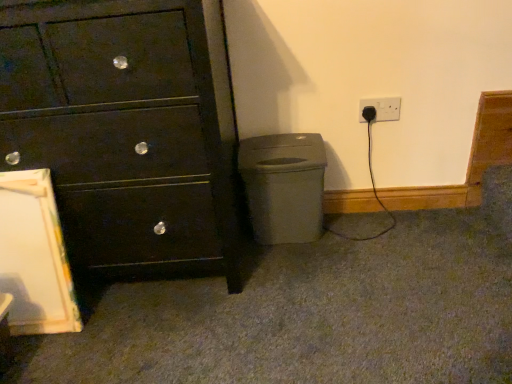
This screenshot has height=384, width=512. In order to click on black plastic plug at lower right in this screenshot , I will do `click(382, 108)`.

This screenshot has width=512, height=384. What do you see at coordinates (124, 127) in the screenshot?
I see `matte black chest of drawers at left` at bounding box center [124, 127].

Identify the location of black plastic plug at lower right. The width and height of the screenshot is (512, 384). (382, 108).

Based on their sizes in the image, would you say black plastic plug at lower right is bigger or smaller than matte black chest of drawers at left?

Clearly, black plastic plug at lower right is smaller in size than matte black chest of drawers at left.

How different are the orientations of black plastic plug at lower right and matte black chest of drawers at left in degrees?

There is a 0.548-degree angle between the facing directions of black plastic plug at lower right and matte black chest of drawers at left.

Choose the correct answer: Is black plastic plug at lower right inside matte black chest of drawers at left or outside it?

black plastic plug at lower right is spatially situated outside matte black chest of drawers at left.

Considering the positions of points (374, 98) and (215, 73), is point (374, 98) closer to camera compared to point (215, 73)?

No, it is behind (215, 73).

Looking at this image, from a real-world perspective, is matte gray plastic at lower right over matte black chest of drawers at left?

No, from a real-world perspective, matte gray plastic at lower right is not above matte black chest of drawers at left.

Considering the relative positions of matte gray plastic at lower right and matte black chest of drawers at left in the image provided, is matte gray plastic at lower right to the left of matte black chest of drawers at left from the viewer's perspective?

No, matte gray plastic at lower right is not to the left of matte black chest of drawers at left.

Is matte gray plastic at lower right placed right next to matte black chest of drawers at left?

No, matte gray plastic at lower right is not with matte black chest of drawers at left.

Can you tell me how much black plastic plug at lower right and matte gray plastic at lower right differ in facing direction?

The angle between the facing direction of black plastic plug at lower right and the facing direction of matte gray plastic at lower right is 0.384 degrees.

Does black plastic plug at lower right touch matte gray plastic at lower right?

No, black plastic plug at lower right is not beside matte gray plastic at lower right.

In the image, is black plastic plug at lower right positioned in front of or behind matte gray plastic at lower right?

Visually, black plastic plug at lower right is located behind matte gray plastic at lower right.

From a real-world perspective, is matte gray plastic at lower right physically located above or below black plastic plug at lower right?

From a real-world perspective, matte gray plastic at lower right is physically below black plastic plug at lower right.

Between matte gray plastic at lower right and black plastic plug at lower right, which one appears on the left side from the viewer's perspective?

matte gray plastic at lower right is more to the left.

From their relative heights in the image, would you say matte gray plastic at lower right is taller or shorter than black plastic plug at lower right?

matte gray plastic at lower right is taller than black plastic plug at lower right.

In terms of height, does matte black chest of drawers at left look taller or shorter compared to matte gray plastic at lower right?

Considering their sizes, matte black chest of drawers at left has more height than matte gray plastic at lower right.

Is matte black chest of drawers at left facing away from matte gray plastic at lower right?

matte black chest of drawers at left is not turned away from matte gray plastic at lower right.

In the image, there is a matte black chest of drawers at left. Where is `waste container below it (from the image's perspective)`? waste container below it (from the image's perspective) is located at coordinates (284, 186).

Is point (20, 119) closer or farther from the camera than point (366, 105)?

Point (20, 119) is positioned closer to the camera compared to point (366, 105).

Is matte black chest of drawers at left thinner than black plastic plug at lower right?

No.

Which object is positioned more to the right, matte black chest of drawers at left or black plastic plug at lower right?

From the viewer's perspective, black plastic plug at lower right appears more on the right side.

Locate an element on the screen. The width and height of the screenshot is (512, 384). power plugs and sockets above the matte black chest of drawers at left (from the image's perspective) is located at coordinates (382, 108).

Locate an element on the screen. waste container that appears on the right of matte black chest of drawers at left is located at coordinates (284, 186).

Consider the image. When comparing their distances from matte black chest of drawers at left, does black plastic plug at lower right or matte gray plastic at lower right seem closer?

matte gray plastic at lower right is positioned closer to the anchor matte black chest of drawers at left.

From the image, which object appears to be nearer to black plastic plug at lower right, matte black chest of drawers at left or matte gray plastic at lower right?

matte gray plastic at lower right.

In the scene shown: Looking at the image, which one is located further to matte black chest of drawers at left, matte gray plastic at lower right or black plastic plug at lower right?

black plastic plug at lower right is positioned further to the anchor matte black chest of drawers at left.

When comparing their distances from matte gray plastic at lower right, does matte black chest of drawers at left or black plastic plug at lower right seem further?

Based on the image, black plastic plug at lower right appears to be further to matte gray plastic at lower right.

Based on their spatial positions, is matte gray plastic at lower right or matte black chest of drawers at left closer to black plastic plug at lower right?

matte gray plastic at lower right.

Which object lies further to the anchor point matte gray plastic at lower right, black plastic plug at lower right or matte black chest of drawers at left?

The object further to matte gray plastic at lower right is black plastic plug at lower right.

Where is `waste container between matte black chest of drawers at left and black plastic plug at lower right`? Image resolution: width=512 pixels, height=384 pixels. waste container between matte black chest of drawers at left and black plastic plug at lower right is located at coordinates pyautogui.click(x=284, y=186).